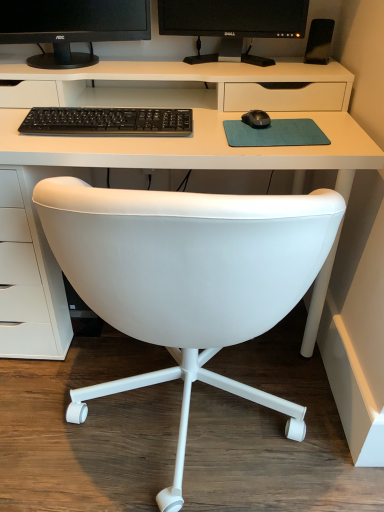
At what (x,y) coordinates should I click in order to perform the action: click on vacant space situated above teal fabric mousepad at center (from a real-world perspective). Please return your answer as a coordinate pair (x, y). Looking at the image, I should click on (284, 127).